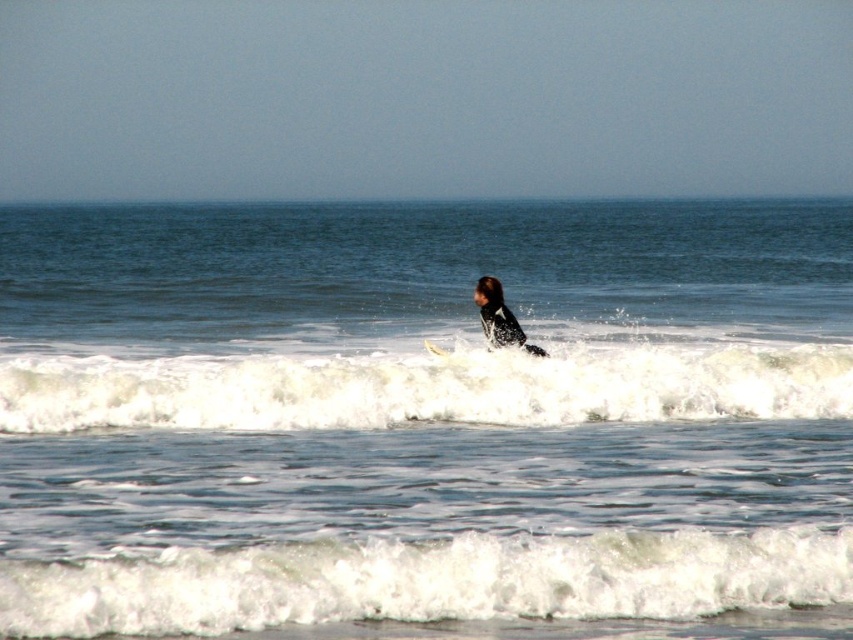
Which is below, blue water at center or white foamy wave at lower center?

white foamy wave at lower center is below.

Consider the image. Is blue water at center smaller than white foamy wave at lower center?

No.

What do you see at coordinates (425, 420) in the screenshot? I see `blue water at center` at bounding box center [425, 420].

Find the location of a particular element. The height and width of the screenshot is (640, 853). blue water at center is located at coordinates (425, 420).

Find the location of a particular element. This screenshot has width=853, height=640. white foamy wave at lower center is located at coordinates (445, 586).

The height and width of the screenshot is (640, 853). What do you see at coordinates (445, 586) in the screenshot?
I see `white foamy wave at lower center` at bounding box center [445, 586].

Between point (419, 602) and point (509, 332), which one is positioned in front?

Positioned in front is point (419, 602).

The height and width of the screenshot is (640, 853). In order to click on white foamy wave at lower center in this screenshot , I will do `click(445, 586)`.

Can you confirm if black wetsuit at center is bigger than white foam surfboard at center?

Correct, black wetsuit at center is larger in size than white foam surfboard at center.

Does black wetsuit at center have a lesser width compared to white foam surfboard at center?

In fact, black wetsuit at center might be wider than white foam surfboard at center.

Describe the element at coordinates (498, 316) in the screenshot. The image size is (853, 640). I see `black wetsuit at center` at that location.

You are a GUI agent. You are given a task and a screenshot of the screen. Output one action in this format:
    pyautogui.click(x=<x>, y=<y>)
    Task: Click on the black wetsuit at center
    Image resolution: width=853 pixels, height=640 pixels.
    Given the screenshot: What is the action you would take?
    pyautogui.click(x=498, y=316)